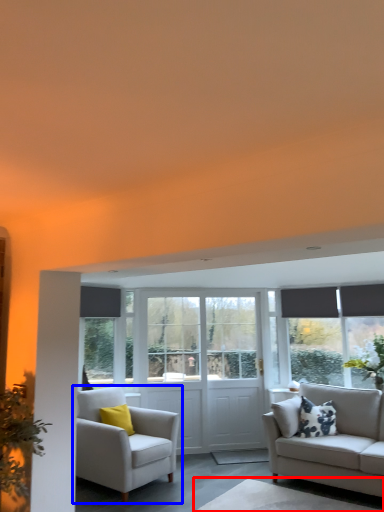
Question: Among these objects, which one is nearest to the camera, table (highlighted by a red box) or chair (highlighted by a blue box)?

Choices:
 (A) table
 (B) chair

Answer: (A)